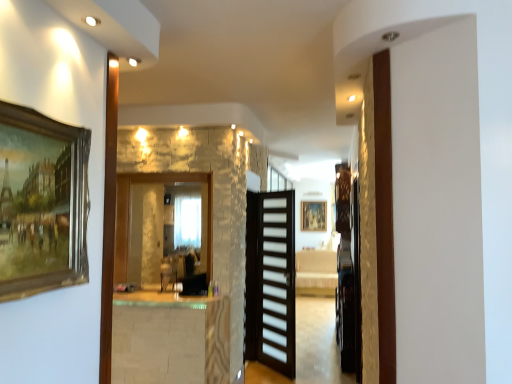
Locate an element on the screen. The height and width of the screenshot is (384, 512). free space above wooden picture frame at left (from a real-world perspective) is located at coordinates (42, 111).